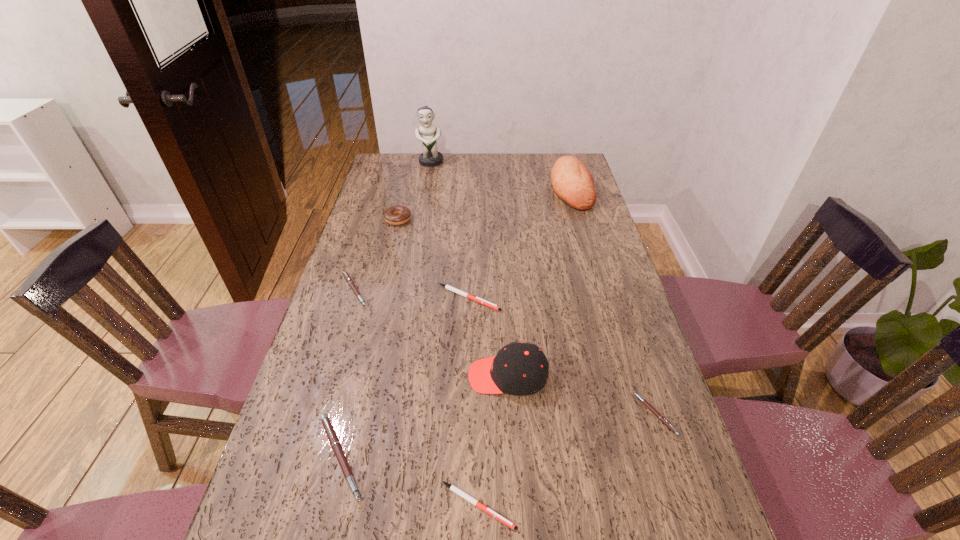
Where is `vacant space located at the nib of the second smallest pink pen`? The width and height of the screenshot is (960, 540). vacant space located at the nib of the second smallest pink pen is located at coordinates (443, 289).

Find the location of a particular element. The height and width of the screenshot is (540, 960). vacant area situated on the clicker of the farther white pen is located at coordinates (564, 298).

I want to click on vacant area located at the nib of the rightmost pen, so click(507, 414).

Locate an element on the screen. The height and width of the screenshot is (540, 960). vacant space situated at the nib of the rightmost pen is located at coordinates (584, 414).

I want to click on vacant space located 0.250m at the nib of the rightmost pen, so click(533, 414).

Locate an element on the screen. This screenshot has height=540, width=960. vacant space located 0.310m on the clicker of the smaller white pen is located at coordinates (671, 505).

I want to click on figurine positioned at the far edge, so click(430, 157).

Find the location of a particular element. The image size is (960, 540). bread at the far edge is located at coordinates (572, 182).

Image resolution: width=960 pixels, height=540 pixels. What are the coordinates of `doughnut that is at the left edge` in the screenshot? It's located at (396, 215).

Find the location of a particular element. The image size is (960, 540). bread at the right edge is located at coordinates (572, 182).